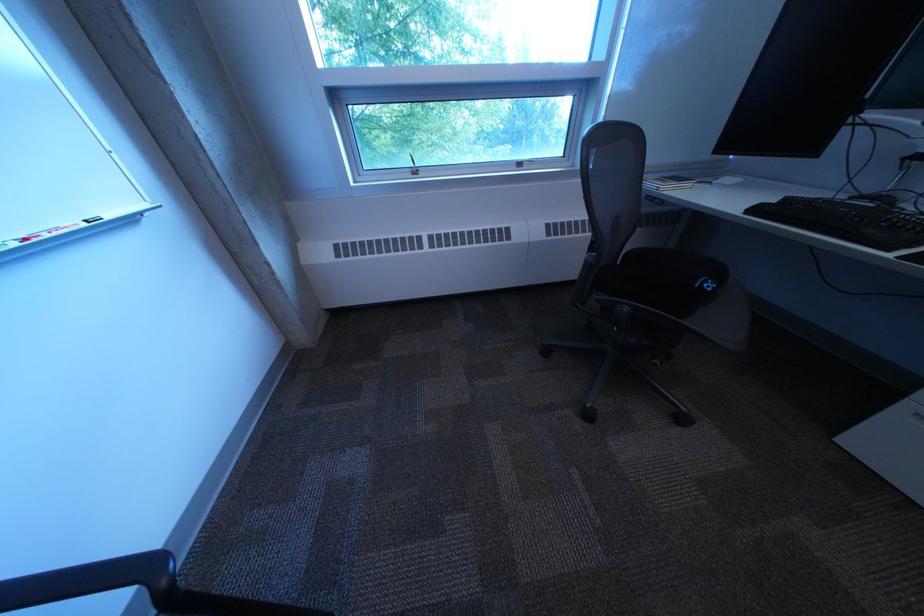
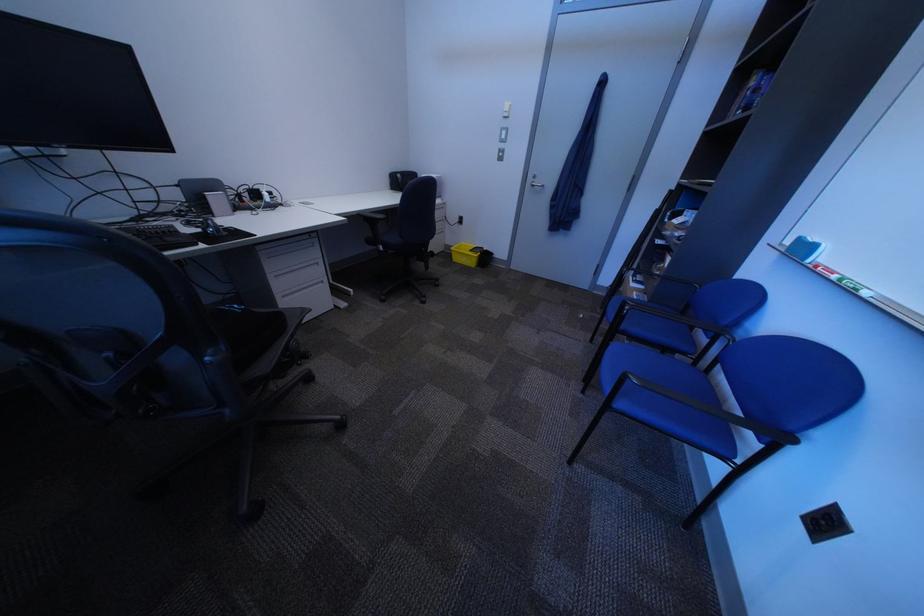
Where in the second image is the point corresponding to (x=720, y=280) from the first image?

(238, 310)